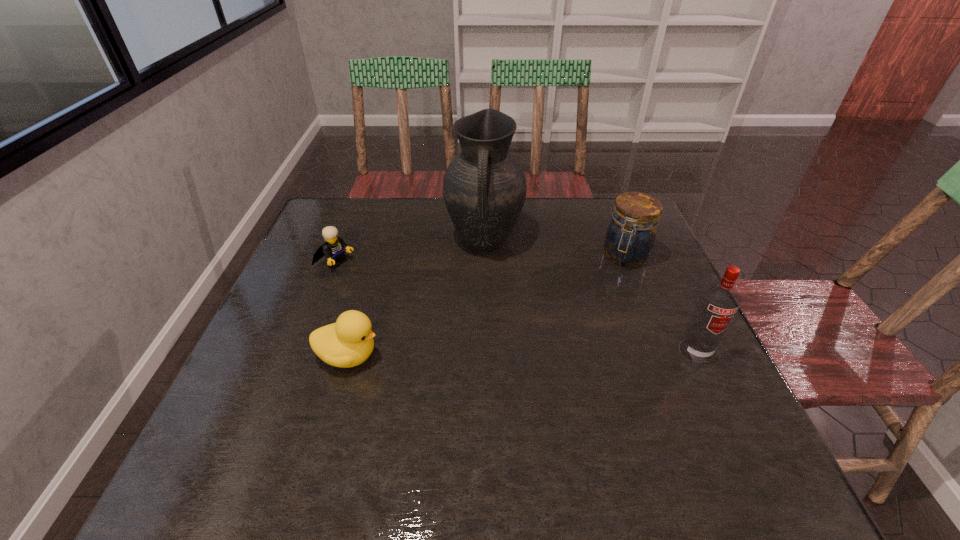
You are a GUI agent. You are given a task and a screenshot of the screen. Output one action in this format:
    pyautogui.click(x=<x>, y=<y>)
    Task: Click on the free space on the desktop that is between the duck and the vodka and is positioned on the front-facing side of the Lego
    
    Given the screenshot: What is the action you would take?
    pyautogui.click(x=518, y=353)

Where is `free space on the desktop that is between the duck and the second tallest object and is positioned on the side of the third object from left to right with the handle`? Image resolution: width=960 pixels, height=540 pixels. free space on the desktop that is between the duck and the second tallest object and is positioned on the side of the third object from left to right with the handle is located at coordinates (475, 354).

This screenshot has width=960, height=540. I want to click on free space on the desktop that is between the duck and the vodka and is positioned on the lid of the jar, so click(x=569, y=353).